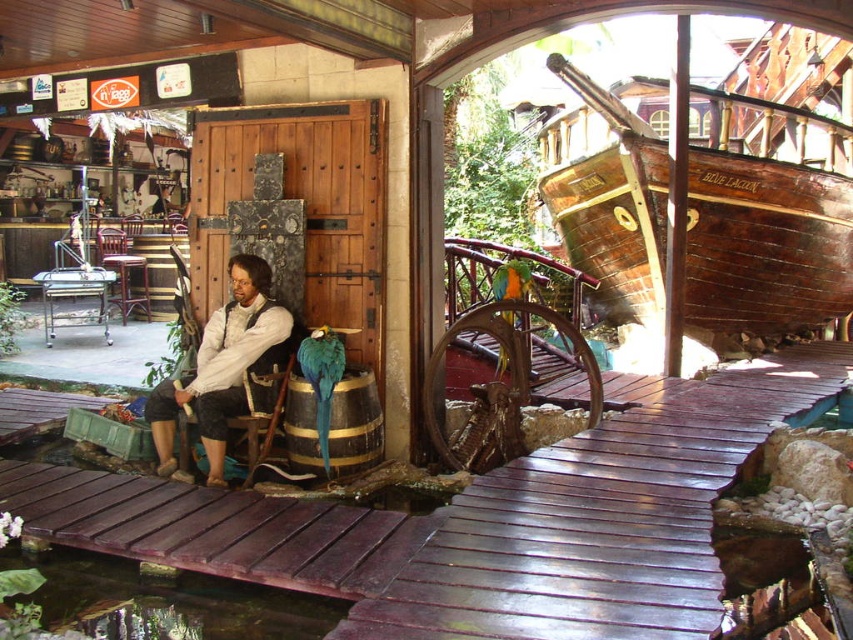
You are a guest in this themed area and want to sit down. You see a white matte shirt at center and a mahogany wood chair at left. Which object is positioned to the left of the other?

The mahogany wood chair at left is positioned to the left of the white matte shirt at center.